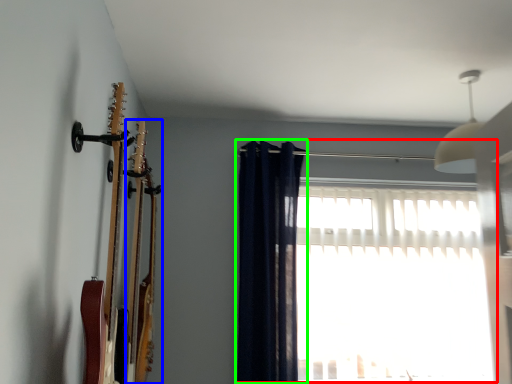
Question: Which object is positioned farthest from window (highlighted by a red box)? Select from guitar (highlighted by a blue box) and curtain (highlighted by a green box).

Choices:
 (A) guitar
 (B) curtain

Answer: (A)